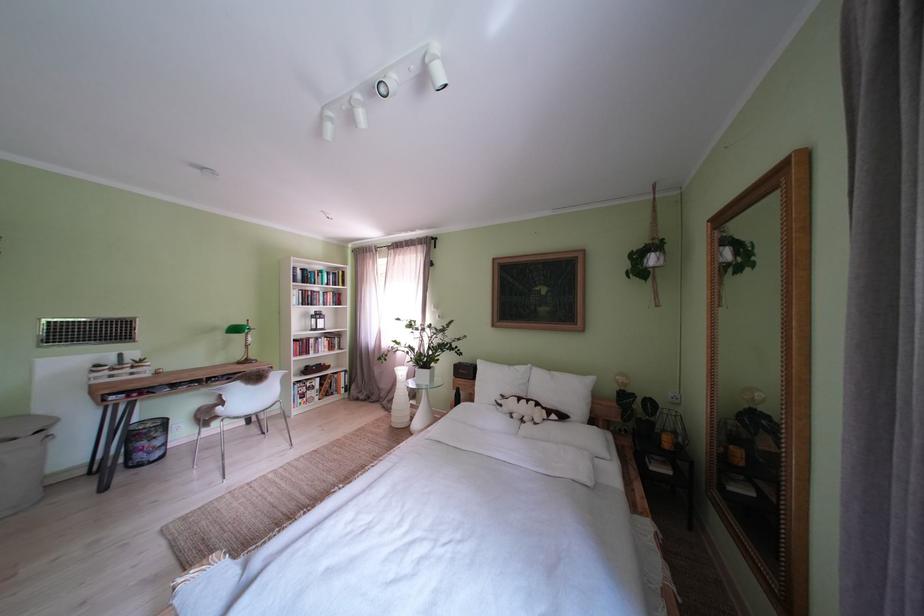
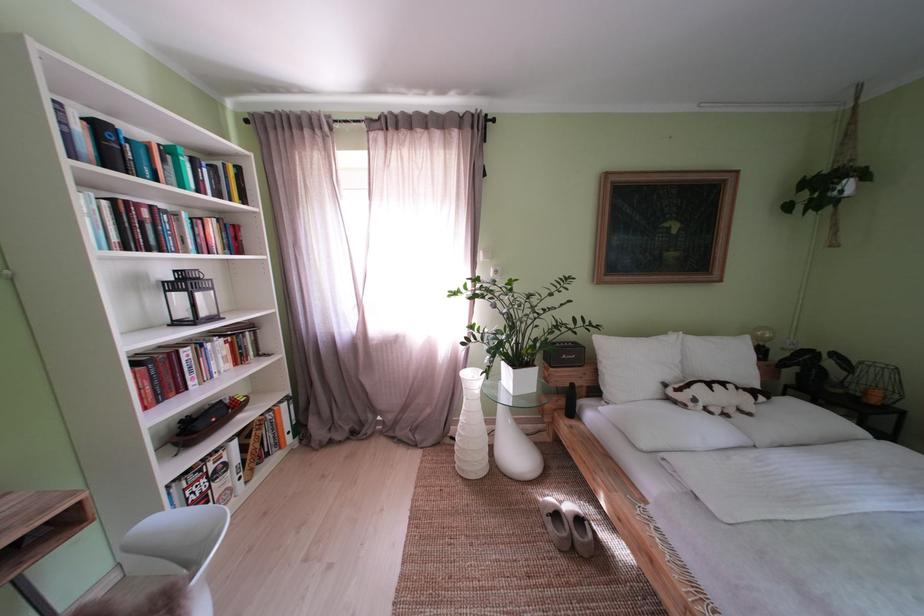
Locate, in the second image, the point that corresponds to pixel 329 321 in the first image.

(198, 286)